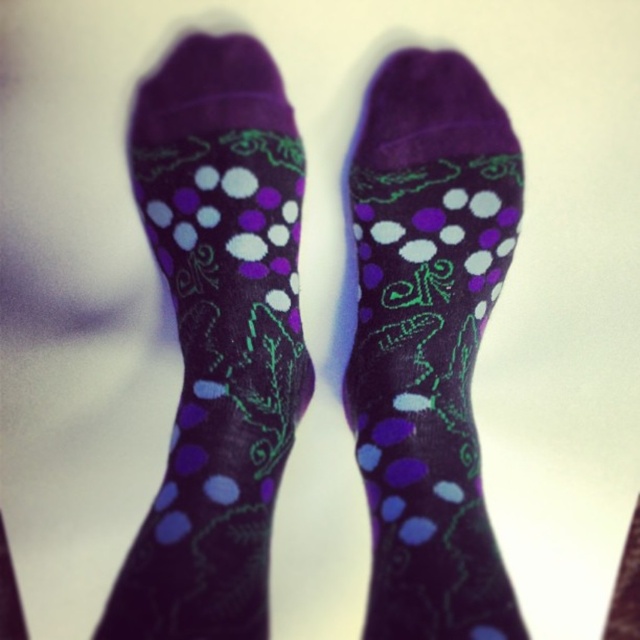
Question: Which point is closer to the camera?

Choices:
 (A) purple matte socks at center
 (B) purple dotted socks at center

Answer: (A)

Question: Is purple dotted socks at center thinner than purple matte socks at center?

Choices:
 (A) yes
 (B) no

Answer: (A)

Question: Does purple dotted socks at center have a lesser width compared to purple matte socks at center?

Choices:
 (A) no
 (B) yes

Answer: (B)

Question: Which object appears closest to the camera in this image?

Choices:
 (A) purple matte socks at center
 (B) purple dotted socks at center

Answer: (A)

Question: Does purple dotted socks at center have a larger size compared to purple matte socks at center?

Choices:
 (A) no
 (B) yes

Answer: (A)